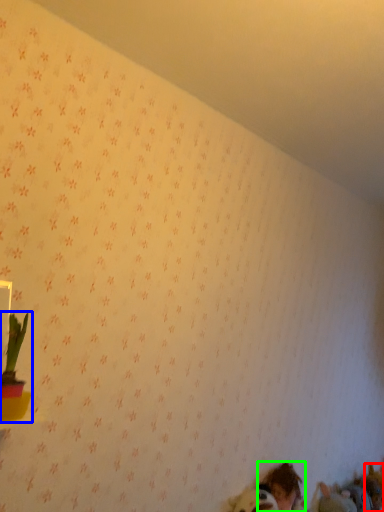
Question: Estimate the real-world distances between objects in this image. Which object is farther from animal (highlighted by a red box), houseplant (highlighted by a blue box) or person (highlighted by a green box)?

Choices:
 (A) houseplant
 (B) person

Answer: (A)